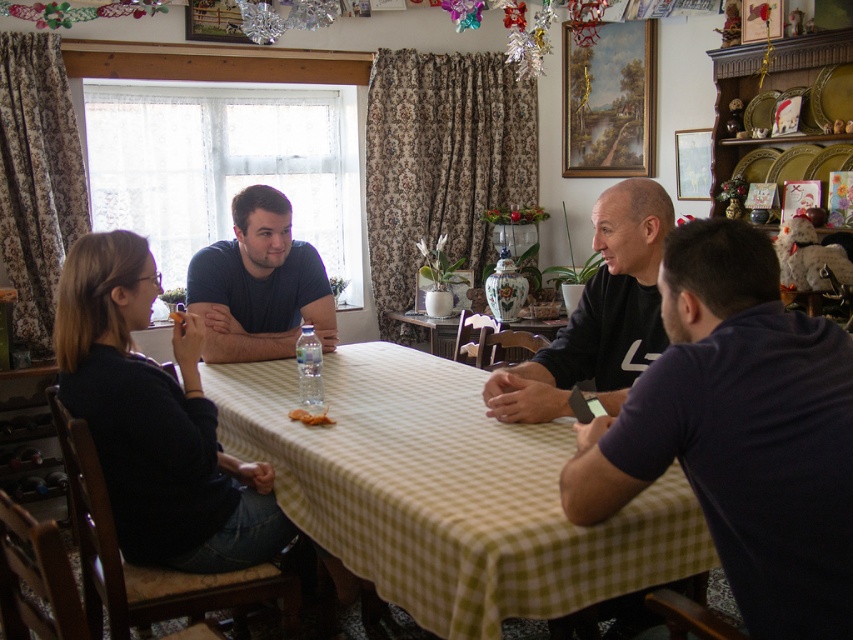
Looking at this image, you are a photographer trying to capture a closeup of the yellow checkered tablecloth at center and the matte blue shirt at center. Since the camera can only focus on one object at a time, which object should you focus on first to ensure it appears in the foreground?

The matte blue shirt at center should be focused on first because it has a greater height than the yellow checkered tablecloth at center, making it naturally appear in the foreground.

You are a photographer trying to capture a candid shot of the dark blue shirt at center and the yellow checkered tablecloth at center. Which object should you zoom in on more to ensure both are clearly visible in the photo?

The dark blue shirt at center is bigger than the yellow checkered tablecloth at center, so you should zoom in more on the dark blue shirt at center to ensure both are clearly visible.